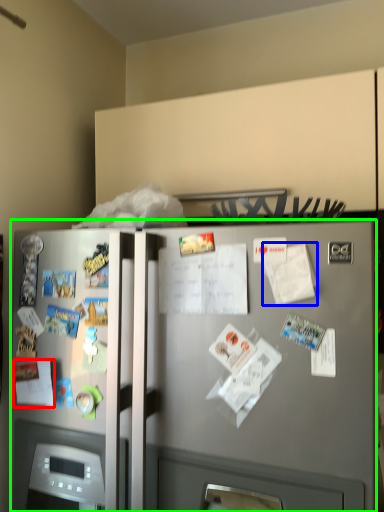
Question: Which object is the farthest from paper (highlighted by a red box)? Choose among these: paper (highlighted by a blue box) or refrigerator (highlighted by a green box).

Choices:
 (A) paper
 (B) refrigerator

Answer: (A)